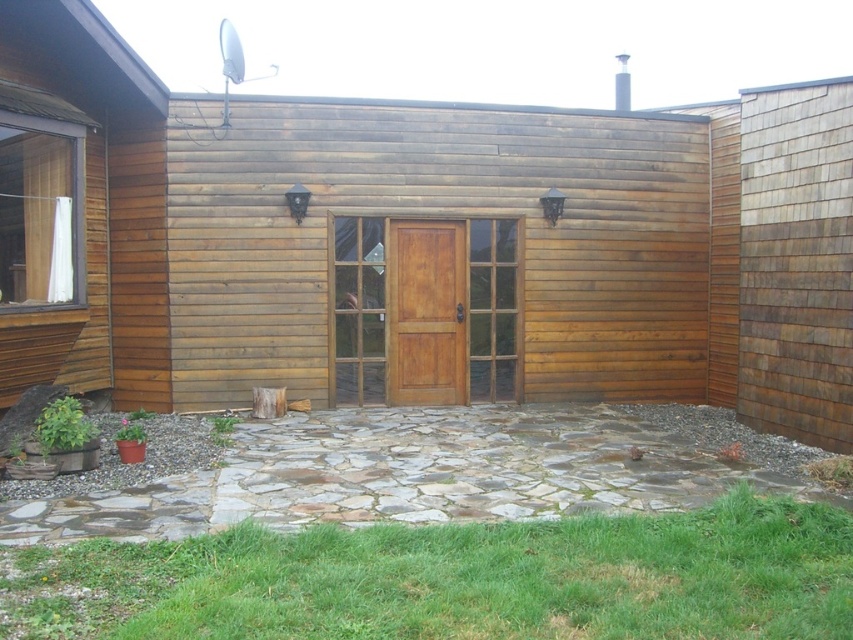
Which is behind, point (534, 586) or point (486, 253)?

The point (486, 253) is more distant.

I want to click on green grass at lower center, so click(x=456, y=579).